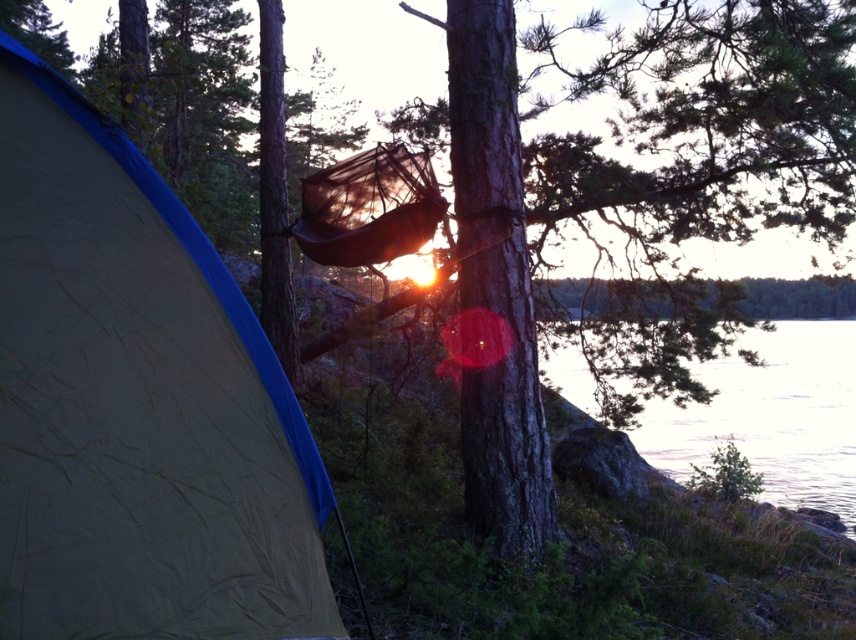
Who is taller, beige fabric tent at left or clear water at lower right?

clear water at lower right

This screenshot has height=640, width=856. What do you see at coordinates (138, 404) in the screenshot?
I see `beige fabric tent at left` at bounding box center [138, 404].

Does point (193, 346) lie in front of point (849, 378)?

Yes, point (193, 346) is in front of point (849, 378).

The image size is (856, 640). Identify the location of beige fabric tent at left. (138, 404).